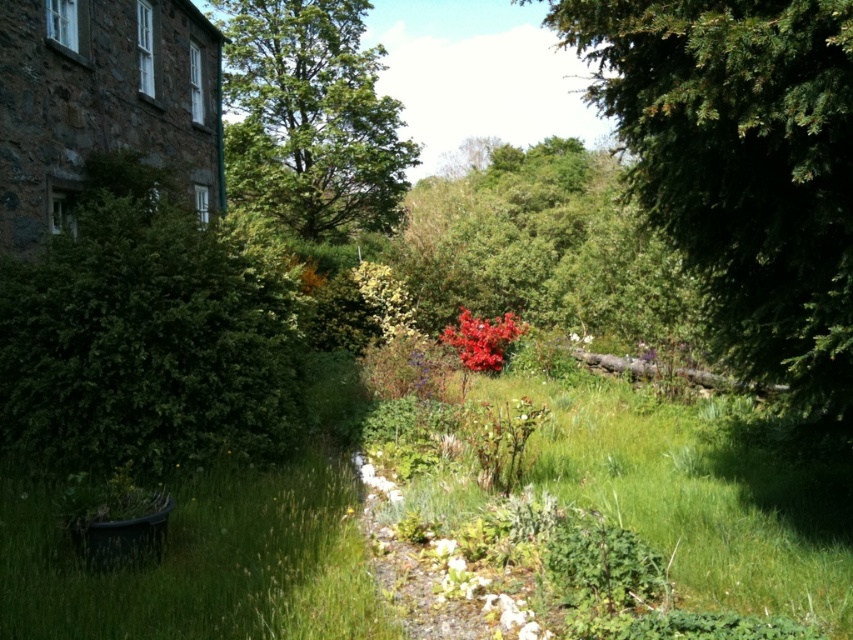
You are standing in the garden and want to walk towards the green leafy tree at upper center. Which direction should you move relative to the green grass at lower left?

To reach the green leafy tree at upper center from the green grass at lower left, you should move towards the left since the green grass at lower left is to the right of the tree.

You are standing in the garden and want to place a 4 meter long bench. Can you fit it in the space between you and the green grass at lower left?

The green grass at lower left is 3.75 meters away from you, so the bench is 0.25 meters longer than the available space. Therefore, it won